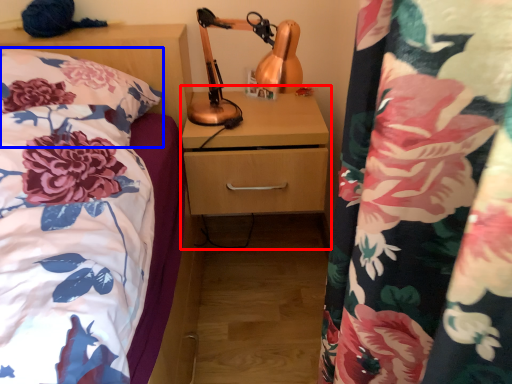
Question: Which object is closer to the camera taking this photo, dresser (highlighted by a red box) or pillow (highlighted by a blue box)?

Choices:
 (A) dresser
 (B) pillow

Answer: (B)